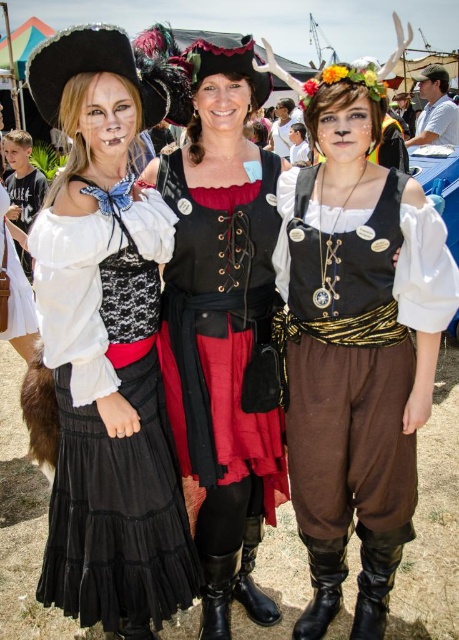
What do you see at coordinates (106, 344) in the screenshot?
I see `matte black dress at left` at bounding box center [106, 344].

Can you confirm if matte black dress at left is taller than matte black vest at center?

Yes, matte black dress at left is taller than matte black vest at center.

Who is more distant from viewer, (x=111, y=336) or (x=369, y=497)?

The point (x=369, y=497) is more distant.

I want to click on matte black dress at left, so click(x=106, y=344).

Does matte black dress at left appear on the right side of black leather vest at center?

No, matte black dress at left is not to the right of black leather vest at center.

Is matte black dress at left positioned in front of black leather vest at center?

Yes, it is.

The height and width of the screenshot is (640, 459). In order to click on matte black dress at left in this screenshot , I will do `click(106, 344)`.

Who is more distant from viewer, [129,497] or [442,116]?

Positioned behind is point [442,116].

Which is more to the right, matte black dress at left or white cotton shirt at upper right?

white cotton shirt at upper right is more to the right.

Is point (118, 180) positioned in front of point (446, 144)?

Yes, point (118, 180) is closer to viewer.

I want to click on matte black dress at left, so click(x=106, y=344).